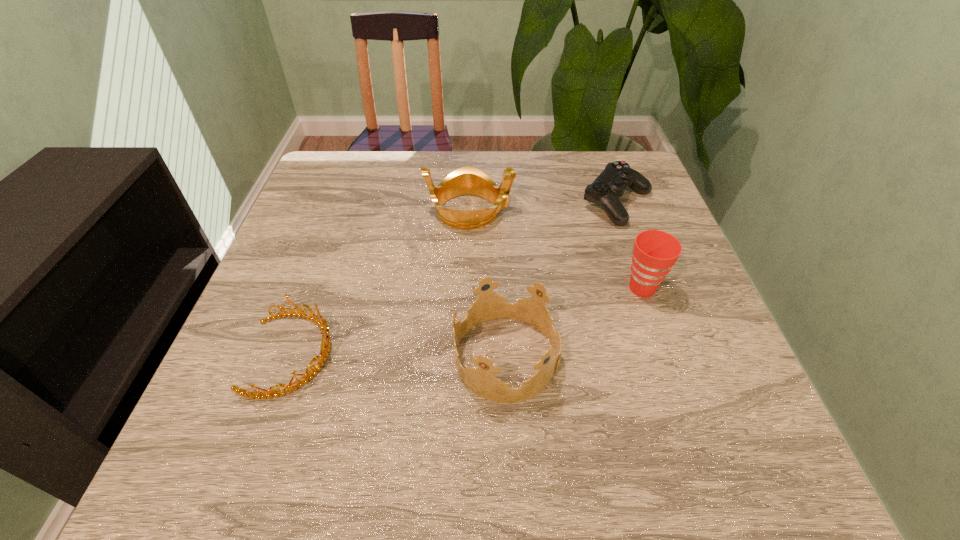
What are the coordinates of `vacant space at the near left corner of the desktop` in the screenshot? It's located at (187, 475).

The width and height of the screenshot is (960, 540). In the image, there is a desktop. What are the coordinates of `free space at the far right corner` in the screenshot? It's located at (610, 163).

Locate an element on the screen. The width and height of the screenshot is (960, 540). free space at the near right corner is located at coordinates (786, 485).

I want to click on free space between the control and the third nearest object, so click(630, 246).

This screenshot has height=540, width=960. In order to click on free spot between the farthest tiara and the cup in this screenshot , I will do `click(556, 249)`.

Identify the location of vacant area that lies between the control and the cup. (630, 246).

Find the location of a particular element. free area in between the control and the farthest tiara is located at coordinates (543, 207).

At what (x,y) coordinates should I click in order to perform the action: click on free space between the third nearest object and the farthest tiara. Please return your answer as a coordinate pair (x, y). The height and width of the screenshot is (540, 960). Looking at the image, I should click on (556, 249).

I want to click on vacant area between the control and the farthest tiara, so click(x=543, y=207).

The width and height of the screenshot is (960, 540). What are the coordinates of `the third closest object relative to the farthest tiara` in the screenshot? It's located at tap(488, 305).